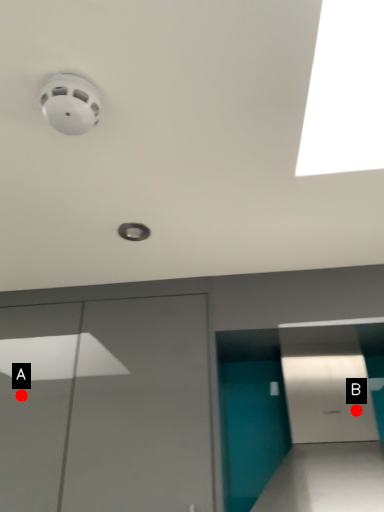
Question: Two points are circled on the image, labeled by A and B beside each circle. Which of the following is the farthest from the observer?

Choices:
 (A) A is further
 (B) B is further

Answer: (B)